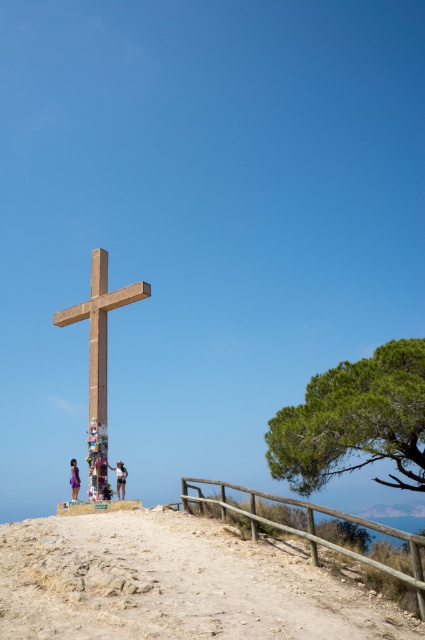
You are a photographer trying to capture the light brown wooden cross at center in your shot. However, there are some light blue denim shorts at center blocking your view. Can you tell me which object is bigger so I know which one to move?

The light blue denim shorts at center is larger in size than the light brown wooden cross at center. Therefore, you need to move the light blue denim shorts at center to get a clear view of the light brown wooden cross at center.

You are a hiker trying to reach the wooden cross at center from the dirt path at center. Considering the space they occupy, which one is narrower in width?

The dirt path at center occupies less space than wooden cross at center, so the dirt path at center is narrower in width.